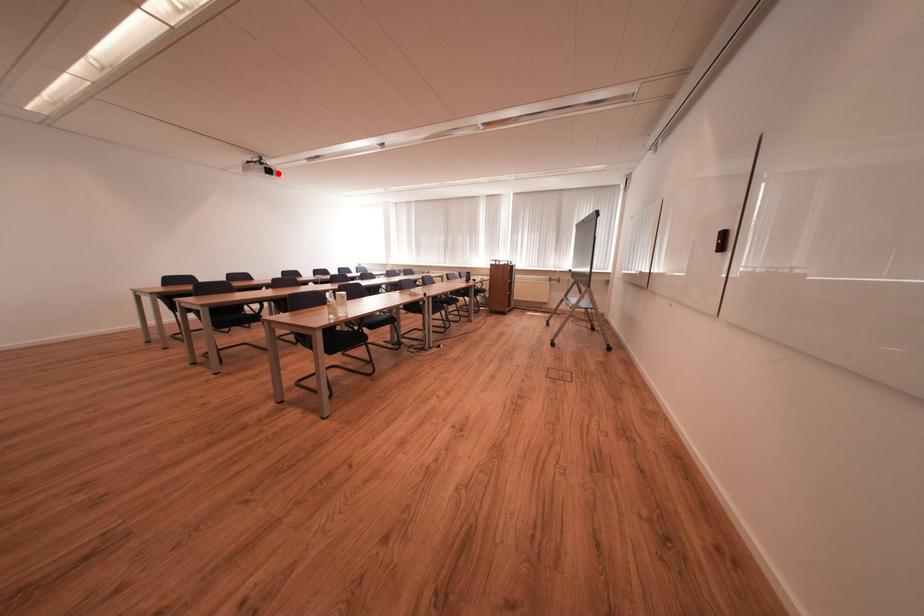
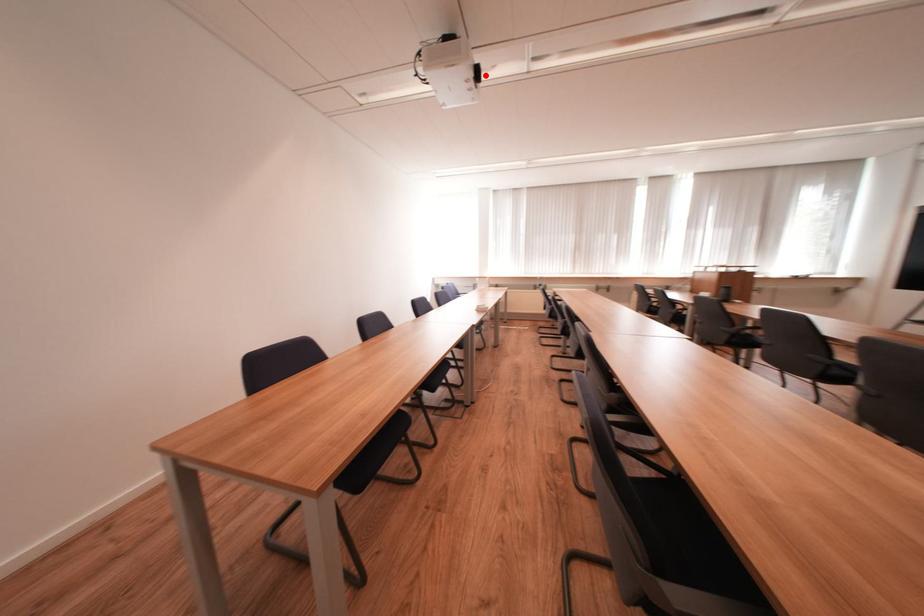
I am providing you with two images of the same scene from different viewpoints. A red point is marked on the first image and another point is marked on the second image. Do the highlighted points in image1 and image2 indicate the same real-world spot?

Yes